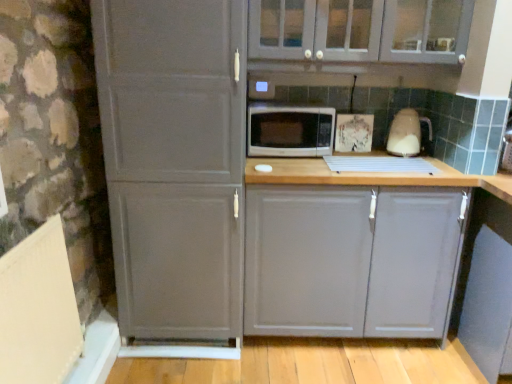
Locate an element on the screen. The width and height of the screenshot is (512, 384). matte gray cabinet at center, the 1th cabinetry positioned from the bottom is located at coordinates (x=351, y=260).

This screenshot has width=512, height=384. Describe the element at coordinates (407, 133) in the screenshot. I see `white glossy kettle at right` at that location.

The width and height of the screenshot is (512, 384). What do you see at coordinates (360, 30) in the screenshot?
I see `matte gray cabinet at upper center, positioned as the second cabinetry in bottom-to-top order` at bounding box center [360, 30].

At what (x,y) coordinates should I click in order to perform the action: click on white glossy microwave at center. Please return your answer as a coordinate pair (x, y). This screenshot has height=384, width=512. Looking at the image, I should click on (289, 131).

What are the coordinates of `matte gray cabinet at center, which is the 2th cabinetry from top to bottom` in the screenshot? It's located at (351, 260).

Is matte gray cabinet at upper center, acting as the first cabinetry starting from the top, spatially inside white glossy kettle at right, or outside of it?

matte gray cabinet at upper center, acting as the first cabinetry starting from the top, is located beyond the bounds of white glossy kettle at right.

How many degrees apart are the facing directions of matte gray cabinet at upper center, positioned as the second cabinetry in bottom-to-top order, and white glossy kettle at right?

The facing directions of matte gray cabinet at upper center, positioned as the second cabinetry in bottom-to-top order, and white glossy kettle at right are 2.47 degrees apart.

Is matte gray cabinet at upper center, positioned as the second cabinetry in bottom-to-top order, wider than white glossy kettle at right?

Yes.

From a real-world perspective, is matte gray cabinet at upper center, acting as the first cabinetry starting from the top, physically located above or below white glossy kettle at right?

matte gray cabinet at upper center, acting as the first cabinetry starting from the top, is above white glossy kettle at right.

What's the angular difference between matte gray cabinet at center, the 1th cabinetry positioned from the bottom, and white glossy kettle at right's facing directions?

matte gray cabinet at center, the 1th cabinetry positioned from the bottom, and white glossy kettle at right are facing 1.81 degrees away from each other.

Is point (276, 327) in front of point (408, 119)?

Yes.

Considering the relative sizes of matte gray cabinet at center, the 1th cabinetry positioned from the bottom, and white glossy kettle at right in the image provided, is matte gray cabinet at center, the 1th cabinetry positioned from the bottom, shorter than white glossy kettle at right?

In fact, matte gray cabinet at center, the 1th cabinetry positioned from the bottom, may be taller than white glossy kettle at right.

Is white glossy kettle at right at the back of matte gray cabinet at center, the 1th cabinetry positioned from the bottom?

That's not correct — matte gray cabinet at center, the 1th cabinetry positioned from the bottom, is not looking away from white glossy kettle at right.

Considering the sizes of objects matte gray cabinet at left and matte gray cabinet at center, the 1th cabinetry positioned from the bottom, in the image provided, who is taller, matte gray cabinet at left or matte gray cabinet at center, the 1th cabinetry positioned from the bottom,?

With more height is matte gray cabinet at left.

Where is `screen door that is above the matte gray cabinet at center, which is the 2th cabinetry from top to bottom (from a real-world perspective)`? screen door that is above the matte gray cabinet at center, which is the 2th cabinetry from top to bottom (from a real-world perspective) is located at coordinates (174, 163).

In the scene shown: Is matte gray cabinet at center, the 1th cabinetry positioned from the bottom, at the back of matte gray cabinet at left?

No, matte gray cabinet at left is not facing the opposite direction of matte gray cabinet at center, the 1th cabinetry positioned from the bottom.

Is matte gray cabinet at center, the 1th cabinetry positioned from the bottom, facing away from matte gray cabinet at upper center, positioned as the second cabinetry in bottom-to-top order?

No, matte gray cabinet at center, the 1th cabinetry positioned from the bottom,'s orientation is not away from matte gray cabinet at upper center, positioned as the second cabinetry in bottom-to-top order.

Who is taller, matte gray cabinet at center, which is the 2th cabinetry from top to bottom, or matte gray cabinet at upper center, positioned as the second cabinetry in bottom-to-top order?

With more height is matte gray cabinet at center, which is the 2th cabinetry from top to bottom.

Which of these two, matte gray cabinet at center, which is the 2th cabinetry from top to bottom, or matte gray cabinet at upper center, acting as the first cabinetry starting from the top, is smaller?

matte gray cabinet at upper center, acting as the first cabinetry starting from the top.

From a real-world perspective, which is physically above, matte gray cabinet at center, which is the 2th cabinetry from top to bottom, or matte gray cabinet at left?

matte gray cabinet at left.

Is matte gray cabinet at center, the 1th cabinetry positioned from the bottom, beside matte gray cabinet at left?

matte gray cabinet at center, the 1th cabinetry positioned from the bottom, is not next to matte gray cabinet at left, and they're not touching.

At what (x,y) coordinates should I click in order to perform the action: click on cabinetry that is the 2nd one when counting backward from the matte gray cabinet at left. Please return your answer as a coordinate pair (x, y). Image resolution: width=512 pixels, height=384 pixels. Looking at the image, I should click on (351, 260).

Which of these two, matte gray cabinet at center, the 1th cabinetry positioned from the bottom, or matte gray cabinet at left, stands taller?

With more height is matte gray cabinet at left.

Considering the relative sizes of matte gray cabinet at left and matte gray cabinet at upper center, positioned as the second cabinetry in bottom-to-top order, in the image provided, is matte gray cabinet at left bigger than matte gray cabinet at upper center, positioned as the second cabinetry in bottom-to-top order,?

Yes.

Would you say matte gray cabinet at left is outside matte gray cabinet at upper center, positioned as the second cabinetry in bottom-to-top order?

matte gray cabinet at left lies outside matte gray cabinet at upper center, positioned as the second cabinetry in bottom-to-top order,'s area.

Based on the photo, is matte gray cabinet at left at the right side of matte gray cabinet at upper center, acting as the first cabinetry starting from the top?

A: In fact, matte gray cabinet at left is to the left of matte gray cabinet at upper center, acting as the first cabinetry starting from the top.

Could you tell me if matte gray cabinet at upper center, acting as the first cabinetry starting from the top, is turned towards matte gray cabinet at left?

No, matte gray cabinet at upper center, acting as the first cabinetry starting from the top, is not aimed at matte gray cabinet at left.

Is matte gray cabinet at upper center, positioned as the second cabinetry in bottom-to-top order, further to camera compared to matte gray cabinet at left?

Yes.

Which point is more forward, (328, 57) or (153, 129)?

The point (153, 129) is in front.

Consider the image. Is matte gray cabinet at left completely or partially inside matte gray cabinet at upper center, positioned as the second cabinetry in bottom-to-top order?

No, matte gray cabinet at left is not inside matte gray cabinet at upper center, positioned as the second cabinetry in bottom-to-top order.

From the white glossy kettle at right, count the 2nd cabinetry to the left and point to it. Please provide its 2D coordinates.

[(360, 30)]

This screenshot has height=384, width=512. What are the coordinates of `appliance positioned vertically above the matte gray cabinet at center, the 1th cabinetry positioned from the bottom (from a real-world perspective)` in the screenshot? It's located at (407, 133).

From the image, which object appears to be nearer to matte gray cabinet at center, the 1th cabinetry positioned from the bottom, matte gray cabinet at left or white glossy microwave at center?

The object closer to matte gray cabinet at center, the 1th cabinetry positioned from the bottom, is matte gray cabinet at left.

Based on their spatial positions, is matte gray cabinet at upper center, positioned as the second cabinetry in bottom-to-top order, or matte gray cabinet at center, the 1th cabinetry positioned from the bottom, closer to matte gray cabinet at left?

Among the two, matte gray cabinet at center, the 1th cabinetry positioned from the bottom, is located nearer to matte gray cabinet at left.

From the image, which object appears to be farther from matte gray cabinet at center, the 1th cabinetry positioned from the bottom, white glossy microwave at center or matte gray cabinet at left?

white glossy microwave at center is positioned further to the anchor matte gray cabinet at center, the 1th cabinetry positioned from the bottom.

Considering their positions, is matte gray cabinet at center, which is the 2th cabinetry from top to bottom, positioned further to white glossy microwave at center than matte gray cabinet at left?

Among the two, matte gray cabinet at center, which is the 2th cabinetry from top to bottom, is located further to white glossy microwave at center.

Considering their positions, is matte gray cabinet at upper center, positioned as the second cabinetry in bottom-to-top order, positioned closer to white glossy kettle at right than white glossy microwave at center?

white glossy microwave at center is positioned closer to the anchor white glossy kettle at right.

From the image, which object appears to be farther from matte gray cabinet at left, matte gray cabinet at upper center, acting as the first cabinetry starting from the top, or white glossy kettle at right?

white glossy kettle at right is positioned further to the anchor matte gray cabinet at left.

Based on their spatial positions, is white glossy microwave at center or matte gray cabinet at center, the 1th cabinetry positioned from the bottom, closer to matte gray cabinet at upper center, positioned as the second cabinetry in bottom-to-top order?

white glossy microwave at center is positioned closer to the anchor matte gray cabinet at upper center, positioned as the second cabinetry in bottom-to-top order.

From the image, which object appears to be farther from white glossy microwave at center, white glossy kettle at right or matte gray cabinet at upper center, positioned as the second cabinetry in bottom-to-top order?

white glossy kettle at right.

Identify the location of appliance between white glossy microwave at center and matte gray cabinet at center, the 1th cabinetry positioned from the bottom, in the vertical direction. [407, 133].

Identify the location of appliance between matte gray cabinet at upper center, positioned as the second cabinetry in bottom-to-top order, and matte gray cabinet at center, which is the 2th cabinetry from top to bottom, in the vertical direction. (407, 133).

Locate an element on the screen. microwave oven between matte gray cabinet at upper center, positioned as the second cabinetry in bottom-to-top order, and matte gray cabinet at center, the 1th cabinetry positioned from the bottom, in the up-down direction is located at coordinates (289, 131).

Where is `microwave oven located between matte gray cabinet at left and matte gray cabinet at upper center, acting as the first cabinetry starting from the top, in the left-right direction`? microwave oven located between matte gray cabinet at left and matte gray cabinet at upper center, acting as the first cabinetry starting from the top, in the left-right direction is located at coordinates (289, 131).